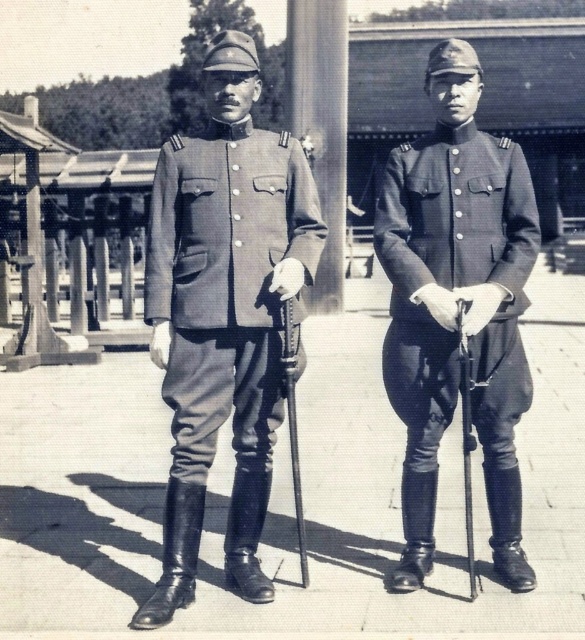
You are a photographer trying to capture a clear photo of the matte uniform at center and the matte black uniform at center. Which one should you focus on first to ensure it appears sharp in the foreground?

You should focus on the matte uniform at center first because it is in front of the matte black uniform at center, making it closer to the camera and thus the foreground subject.

You are a photographer trying to capture both the matte uniform at center and the matte black uniform at center in a single frame. Which uniform should you focus on first to ensure both are in the frame?

The matte uniform at center is larger in size than the matte black uniform at center, so you should focus on the matte uniform at center first to ensure both are in the frame.